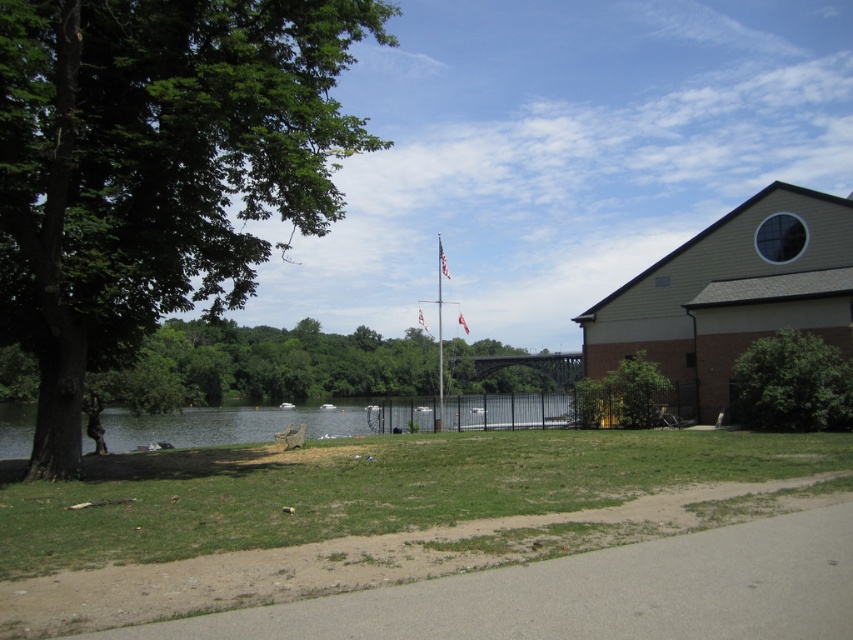
You are standing at the lakeside and want to reach a specific point marked at coordinates point (28, 355). If your maximum walking distance is 20 meters, can you comfortably walk to that point without exceeding your limit?

The distance of point (28, 355) from viewer is 20.85 meters, which is slightly beyond your 20 meters limit. Therefore, you cannot comfortably walk to that point without exceeding your limit.

You are standing at the edge of the lake and want to walk towards the two points marked in the image. Which point, point (218, 384) or point (169, 413), will you reach first?

Point (169, 413) will be reached first because it is closer to the camera compared to point (218, 384), which is further away.